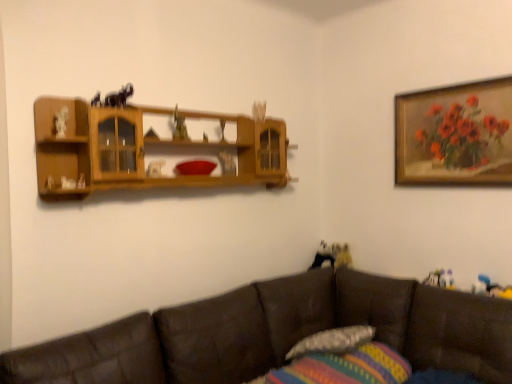
Question: Can you confirm if textured fabric pillow at lower center, which is the second pillow from bottom to top, is bigger than brown leather couch at lower right?

Choices:
 (A) yes
 (B) no

Answer: (B)

Question: Does textured fabric pillow at lower center, which appears as the 1th pillow when viewed from the top, turn towards brown leather couch at lower right?

Choices:
 (A) no
 (B) yes

Answer: (B)

Question: Does textured fabric pillow at lower center, which appears as the 1th pillow when viewed from the top, come in front of brown leather couch at lower right?

Choices:
 (A) no
 (B) yes

Answer: (A)

Question: Considering the relative sizes of textured fabric pillow at lower center, which appears as the 1th pillow when viewed from the top, and brown leather couch at lower right in the image provided, is textured fabric pillow at lower center, which appears as the 1th pillow when viewed from the top, shorter than brown leather couch at lower right?

Choices:
 (A) yes
 (B) no

Answer: (A)

Question: Is textured fabric pillow at lower center, which appears as the 1th pillow when viewed from the top, facing away from brown leather couch at lower right?

Choices:
 (A) no
 (B) yes

Answer: (B)

Question: From a real-world perspective, is textured fabric pillow at lower center, which appears as the 1th pillow when viewed from the top, on brown leather couch at lower right?

Choices:
 (A) no
 (B) yes

Answer: (B)

Question: Is brown leather couch at lower right touching textured fabric pillow at lower center, which appears as the 1th pillow when viewed from the top?

Choices:
 (A) no
 (B) yes

Answer: (A)

Question: Could you tell me if brown leather couch at lower right is facing textured fabric pillow at lower center, which appears as the 1th pillow when viewed from the top?

Choices:
 (A) yes
 (B) no

Answer: (A)

Question: Does brown leather couch at lower right have a lesser width compared to textured fabric pillow at lower center, which is the second pillow from bottom to top?

Choices:
 (A) no
 (B) yes

Answer: (A)

Question: Does brown leather couch at lower right appear on the left side of textured fabric pillow at lower center, which appears as the 1th pillow when viewed from the top?

Choices:
 (A) no
 (B) yes

Answer: (B)

Question: Is textured fabric pillow at lower center, which is the second pillow from bottom to top, at the back of brown leather couch at lower right?

Choices:
 (A) yes
 (B) no

Answer: (A)

Question: Is brown leather couch at lower right outside of textured fabric pillow at lower center, which is the second pillow from bottom to top?

Choices:
 (A) no
 (B) yes

Answer: (B)

Question: Is the depth of wooden framed painting of flowers at upper right less than that of striped fabric pillow at lower center, which ranks as the 1th pillow in bottom-to-top order?

Choices:
 (A) yes
 (B) no

Answer: (B)